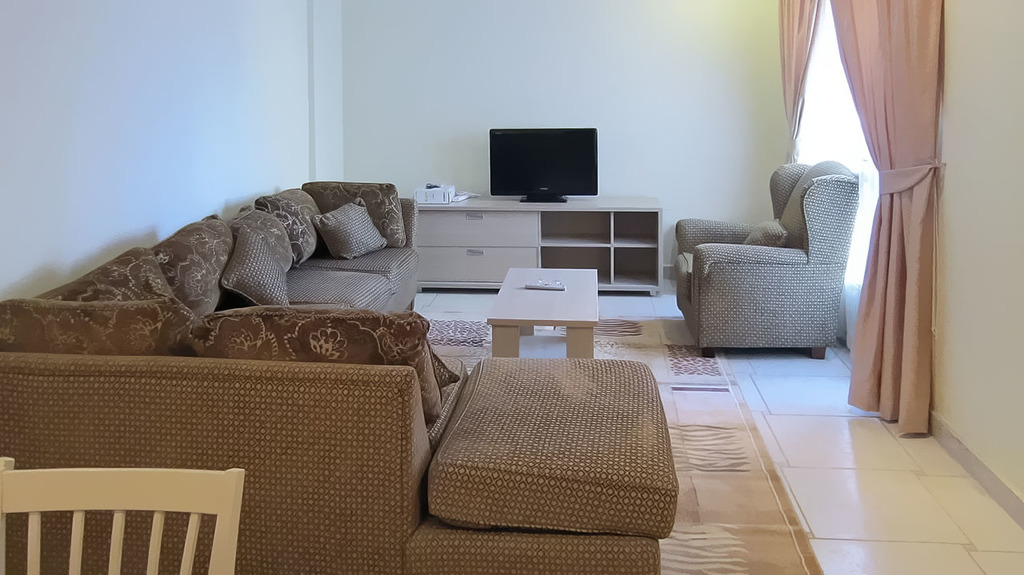
Where is `pink drapes`? Image resolution: width=1024 pixels, height=575 pixels. pink drapes is located at coordinates (897, 102), (806, 41).